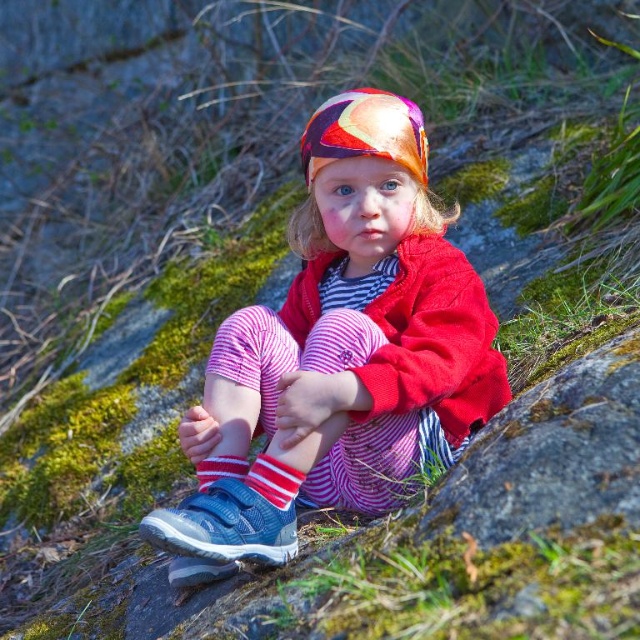
Can you confirm if striped cotton pants at center is smaller than striped cotton sock at center?

Actually, striped cotton pants at center might be larger than striped cotton sock at center.

Between striped cotton pants at center and striped cotton sock at center, which one appears on the right side from the viewer's perspective?

Positioned to the right is striped cotton pants at center.

Does point (422, 316) come closer to viewer compared to point (221, 456)?

Yes, point (422, 316) is closer to viewer.

Locate an element on the screen. This screenshot has height=640, width=640. striped cotton pants at center is located at coordinates (358, 323).

Does striped cotton sock at lower center have a lesser height compared to striped cotton sock at center?

Incorrect, striped cotton sock at lower center's height does not fall short of striped cotton sock at center's.

Who is more forward, (278,477) or (243,467)?

Point (278,477) is more forward.

Describe the element at coordinates (275, 480) in the screenshot. The width and height of the screenshot is (640, 640). I see `striped cotton sock at lower center` at that location.

In order to click on striped cotton sock at lower center in this screenshot , I will do `click(275, 480)`.

The height and width of the screenshot is (640, 640). What do you see at coordinates (358, 323) in the screenshot?
I see `striped cotton pants at center` at bounding box center [358, 323].

Does striped cotton pants at center have a smaller size compared to striped cotton sock at lower center?

No.

Between point (326, 330) and point (284, 476), which one is positioned behind?

Point (326, 330)

Image resolution: width=640 pixels, height=640 pixels. Find the location of `striped cotton pants at center`. striped cotton pants at center is located at coordinates [x=358, y=323].